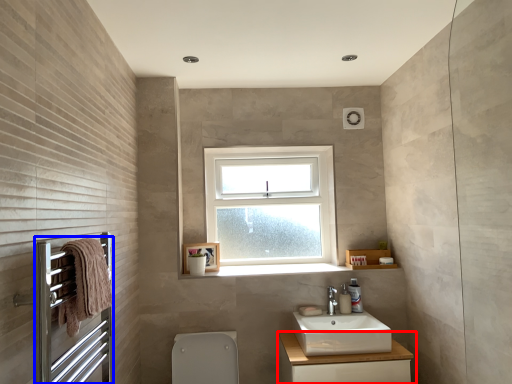
Question: Which object is further to the camera taking this photo, bathroom cabinet (highlighted by a red box) or screen door (highlighted by a blue box)?

Choices:
 (A) bathroom cabinet
 (B) screen door

Answer: (A)